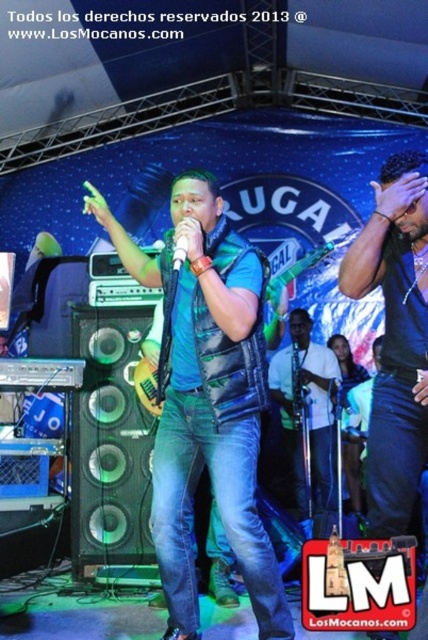
Question: Which point is farther to the camera?

Choices:
 (A) blue leather vest at center
 (B) white plastic microphone at center

Answer: (A)

Question: Where is blue leather vest at center located in relation to white plastic microphone at center in the image?

Choices:
 (A) right
 (B) left

Answer: (A)

Question: Considering the real-world distances, which object is farthest from the white plastic microphone at center?

Choices:
 (A) white matte shirt at center
 (B) blue leather vest at center

Answer: (A)

Question: Which of the following is the farthest from the observer?

Choices:
 (A) (181, 253)
 (B) (309, 419)
 (C) (184, 296)

Answer: (B)

Question: Is white matte shirt at center closer to camera compared to white plastic microphone at center?

Choices:
 (A) no
 (B) yes

Answer: (A)

Question: Is white matte shirt at center wider than white plastic microphone at center?

Choices:
 (A) yes
 (B) no

Answer: (A)